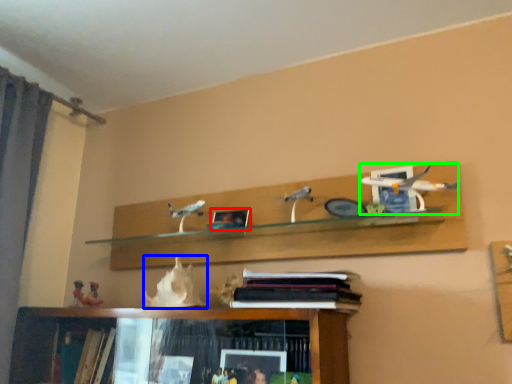
Question: Which is nearer to the picture frame (highlighted by a red box)? animal (highlighted by a blue box) or toy (highlighted by a green box).

Choices:
 (A) animal
 (B) toy

Answer: (A)